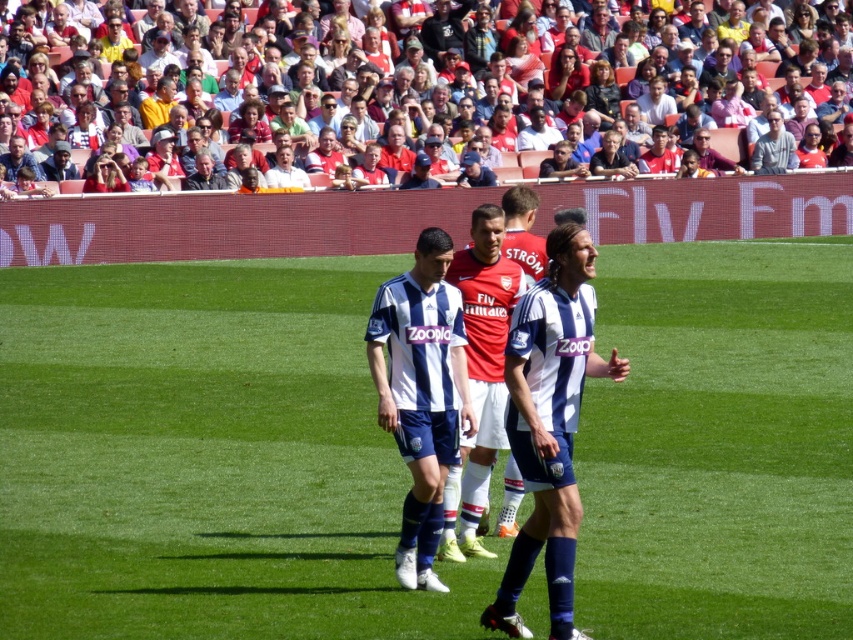
Question: Which point appears farthest from the camera in this image?

Choices:
 (A) (198, 184)
 (B) (293, 173)
 (C) (210, 484)

Answer: (B)

Question: Is white matte soccer jersey at center positioned behind white plastic seats at upper center?

Choices:
 (A) no
 (B) yes

Answer: (A)

Question: Considering the relative positions of white matte soccer jersey at center and white shirt at upper center in the image provided, where is white matte soccer jersey at center located with respect to white shirt at upper center?

Choices:
 (A) below
 (B) above

Answer: (A)

Question: Estimate the real-world distances between objects in this image. Which object is farther from the white plastic seats at upper center?

Choices:
 (A) gray fabric jacket at upper center
 (B) green grass football field at center
 (C) white striped jersey at center

Answer: (C)

Question: Based on their relative distances, which object is farther from the white striped jersey at center?

Choices:
 (A) white matte soccer jersey at center
 (B) white plastic seats at upper center
 (C) gray knit sweater at upper right

Answer: (C)

Question: Does white matte soccer jersey at center have a greater width compared to white shirt at upper center?

Choices:
 (A) yes
 (B) no

Answer: (B)